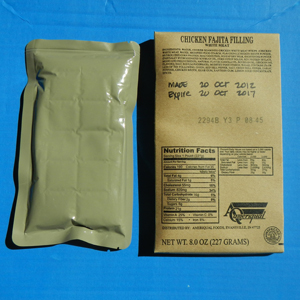
This screenshot has width=300, height=300. I want to click on floor, so point(99,277).